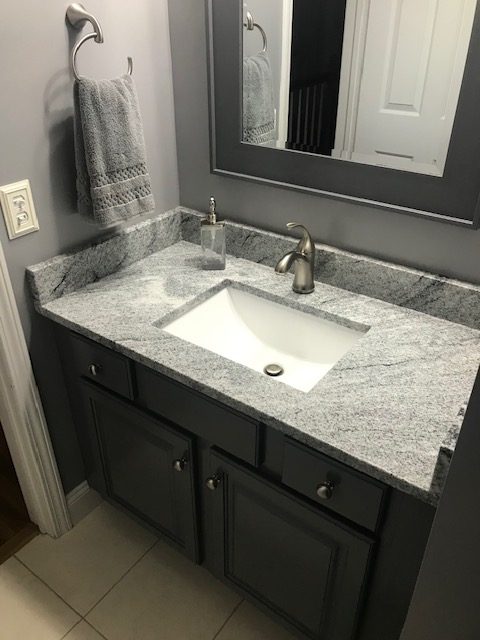
Find the location of a particular element. The width and height of the screenshot is (480, 640). light switch is located at coordinates (23, 210).